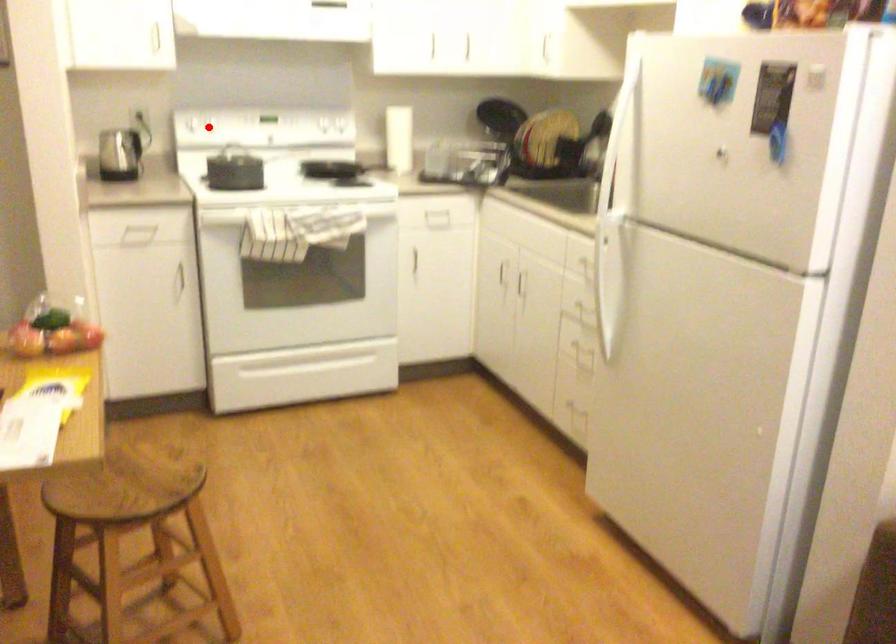
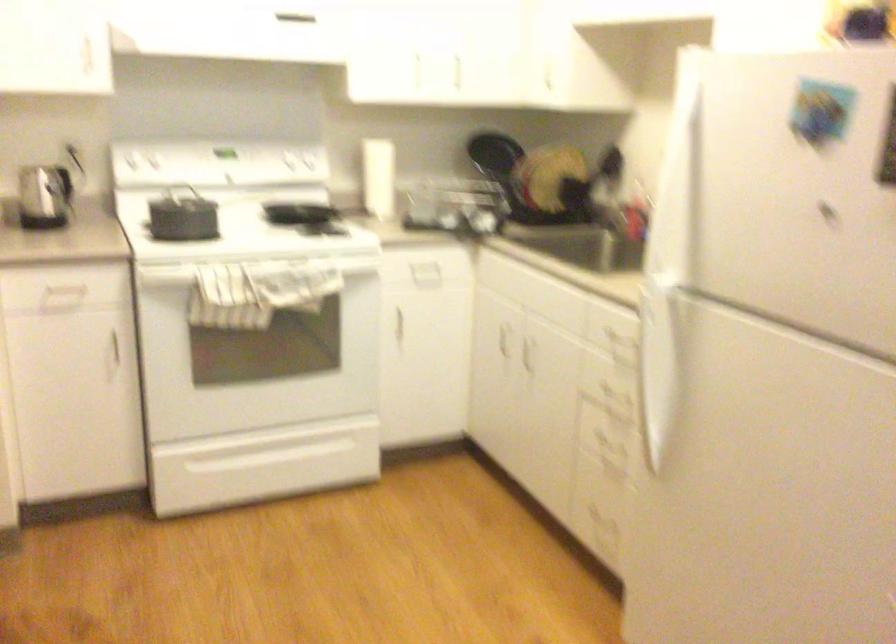
The point at the highlighted location is marked in the first image. Where is the corresponding point in the second image?

(158, 171)